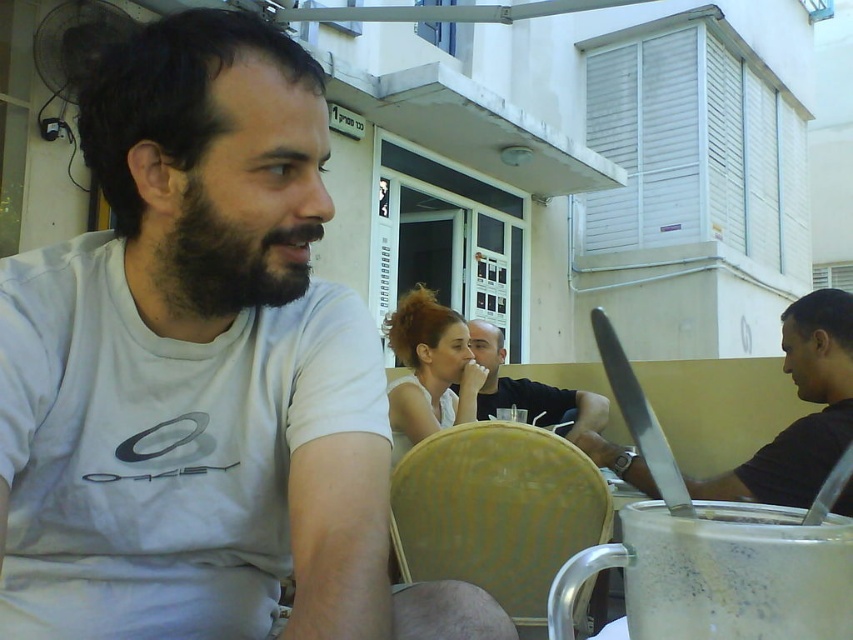
Does white frothy beverage at lower right have a larger size compared to matte black shirt at center?

Incorrect, white frothy beverage at lower right is not larger than matte black shirt at center.

Who is more distant from viewer, (722,589) or (550,403)?

The point (550,403) is more distant.

The height and width of the screenshot is (640, 853). In order to click on white frothy beverage at lower right in this screenshot , I will do `click(735, 572)`.

Measure the distance from matte white blouse at center to matte black shirt at center.

The distance of matte white blouse at center from matte black shirt at center is 9.27 inches.

Does point (399, 321) come in front of point (497, 374)?

Yes.

You are a GUI agent. You are given a task and a screenshot of the screen. Output one action in this format:
    pyautogui.click(x=<x>, y=<y>)
    Task: Click on the matte white blouse at center
    The height and width of the screenshot is (640, 853).
    Given the screenshot: What is the action you would take?
    pyautogui.click(x=428, y=369)

In the scene shown: Measure the distance from white matte t-shirt at center to white frothy beverage at lower right.

white matte t-shirt at center is 18.13 inches from white frothy beverage at lower right.

Can you confirm if white matte t-shirt at center is bigger than white frothy beverage at lower right?

Correct, white matte t-shirt at center is larger in size than white frothy beverage at lower right.

The image size is (853, 640). What are the coordinates of `white matte t-shirt at center` in the screenshot? It's located at (201, 374).